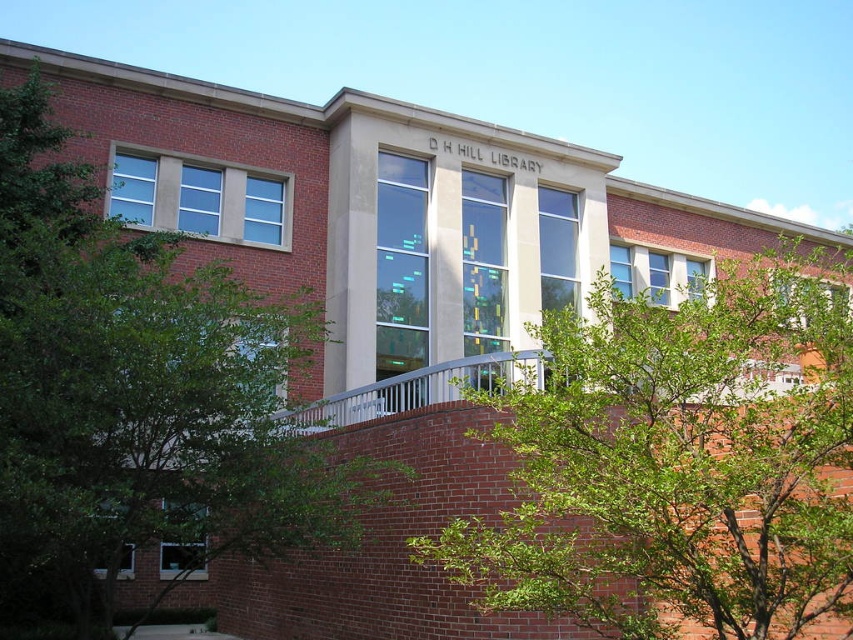
Can you confirm if green leafy tree at center is wider than green leafy tree at upper left?

Yes, green leafy tree at center is wider than green leafy tree at upper left.

Which is in front, point (505, 593) or point (65, 506)?

Point (505, 593) is more forward.

Identify the location of green leafy tree at center. This screenshot has height=640, width=853. [677, 460].

Is green leafy tree at center closer to camera compared to white metal rail at center?

Yes, it is.

Does green leafy tree at center have a lesser width compared to white metal rail at center?

No.

What do you see at coordinates (677, 460) in the screenshot? The height and width of the screenshot is (640, 853). I see `green leafy tree at center` at bounding box center [677, 460].

Locate an element on the screen. green leafy tree at center is located at coordinates (677, 460).

Which is more to the right, green leafy tree at upper left or white metal rail at center?

white metal rail at center

Looking at this image, is green leafy tree at upper left thinner than white metal rail at center?

No, green leafy tree at upper left is not thinner than white metal rail at center.

Is point (54, 486) farther from viewer compared to point (370, 410)?

No, (54, 486) is closer to viewer.

At what (x,y) coordinates should I click in order to perform the action: click on green leafy tree at upper left. Please return your answer as a coordinate pair (x, y). Looking at the image, I should click on (141, 394).